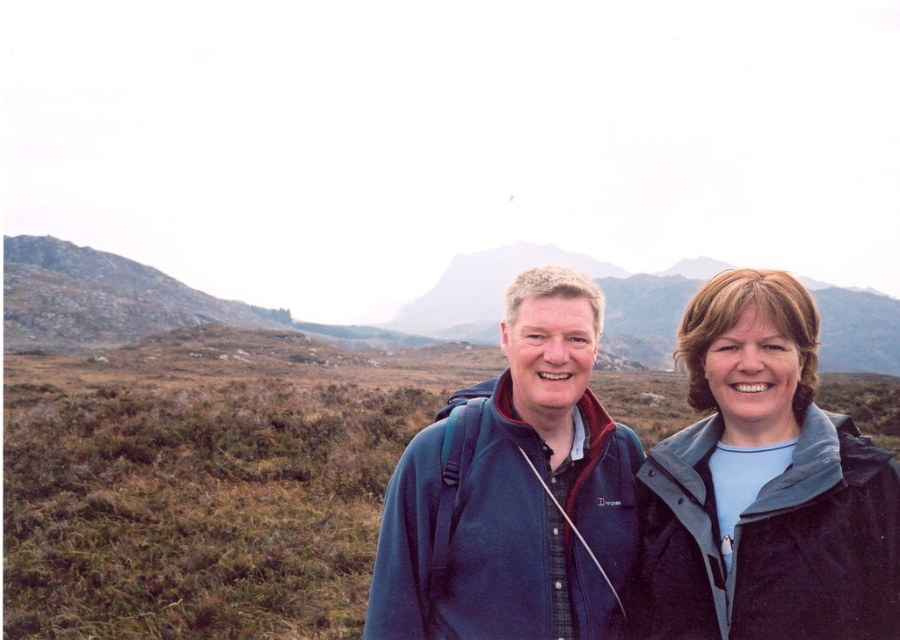
You are a photographer trying to capture both the blue fabric jacket at right and the blue fleece jacket at center in a single frame. Based on their positions, which jacket would appear closer to the camera?

The blue fabric jacket at right is positioned under the blue fleece jacket at center, so it would appear closer to the camera.

You are a hiker planning to cross a narrow mountain path. You see two people ahead wearing jackets. The first is wearing a blue fleece jacket at center, and the second is wearing a blue fabric jacket at right. Which hiker is closer to the path you want to take?

The blue fabric jacket at right is to the right of the blue fleece jacket at center, so the blue fleece jacket at center is closer to the path you want to take.